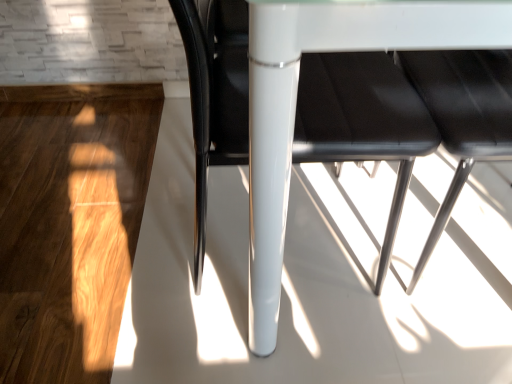
Question: Considering their positions, is glossy black chair at center located in front of or behind white glossy table at center?

Choices:
 (A) behind
 (B) front

Answer: (A)

Question: From a real-world perspective, is glossy black chair at center positioned above or below white glossy table at center?

Choices:
 (A) above
 (B) below

Answer: (B)

Question: In terms of height, does glossy black chair at center look taller or shorter compared to white glossy table at center?

Choices:
 (A) short
 (B) tall

Answer: (A)

Question: Is white glossy table at center bigger or smaller than glossy black chair at center?

Choices:
 (A) big
 (B) small

Answer: (A)

Question: Does point (446, 39) appear closer or farther from the camera than point (200, 221)?

Choices:
 (A) farther
 (B) closer

Answer: (B)

Question: In terms of width, does white glossy table at center look wider or thinner when compared to glossy black chair at center?

Choices:
 (A) wide
 (B) thin

Answer: (A)

Question: Considering the relative positions of white glossy table at center and glossy black chair at center in the image provided, is white glossy table at center to the left or to the right of glossy black chair at center?

Choices:
 (A) left
 (B) right

Answer: (B)